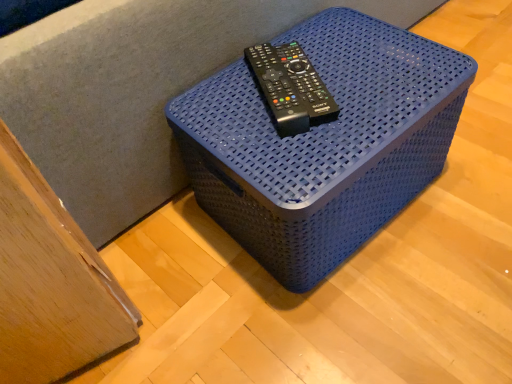
The image size is (512, 384). Find the location of `free spot behind black plastic remote control at center`. free spot behind black plastic remote control at center is located at coordinates (289, 36).